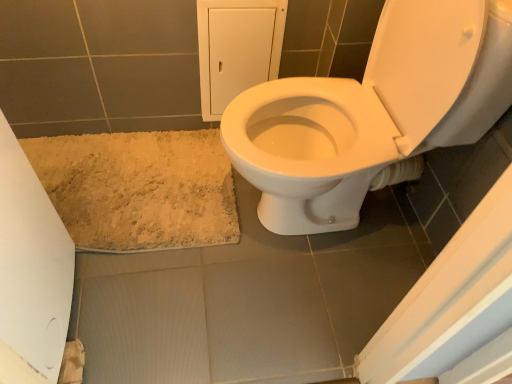
Question: From a real-world perspective, is white glossy toilet at center on white paper at lower left?

Choices:
 (A) no
 (B) yes

Answer: (B)

Question: Is white glossy toilet at center bigger than white paper at lower left?

Choices:
 (A) no
 (B) yes

Answer: (B)

Question: Is white paper at lower left at the back of white glossy toilet at center?

Choices:
 (A) no
 (B) yes

Answer: (A)

Question: Is white glossy toilet at center to the left of white paper at lower left from the viewer's perspective?

Choices:
 (A) no
 (B) yes

Answer: (A)

Question: Considering the relative positions of white glossy toilet at center and white paper at lower left in the image provided, is white glossy toilet at center behind white paper at lower left?

Choices:
 (A) yes
 (B) no

Answer: (B)

Question: Is white glossy toilet at center at the right side of white paper at lower left?

Choices:
 (A) yes
 (B) no

Answer: (A)

Question: Does white paper at lower left have a larger size compared to beige shaggy bath mat at lower left?

Choices:
 (A) no
 (B) yes

Answer: (A)

Question: Is white paper at lower left facing towards beige shaggy bath mat at lower left?

Choices:
 (A) yes
 (B) no

Answer: (B)

Question: From a real-world perspective, is white paper at lower left positioned over beige shaggy bath mat at lower left based on gravity?

Choices:
 (A) yes
 (B) no

Answer: (B)

Question: Does white paper at lower left have a lesser height compared to beige shaggy bath mat at lower left?

Choices:
 (A) no
 (B) yes

Answer: (B)

Question: Is white paper at lower left to the left of beige shaggy bath mat at lower left from the viewer's perspective?

Choices:
 (A) yes
 (B) no

Answer: (B)

Question: Does white paper at lower left have a smaller size compared to beige shaggy bath mat at lower left?

Choices:
 (A) no
 (B) yes

Answer: (B)

Question: Is beige shaggy bath mat at lower left at the right side of white paper at lower left?

Choices:
 (A) no
 (B) yes

Answer: (A)